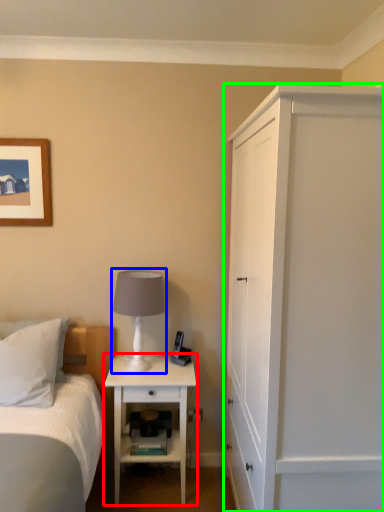
Question: Which object is positioned farthest from nightstand (highlighted by a red box)? Select from table lamp (highlighted by a blue box) and cabinetry (highlighted by a green box).

Choices:
 (A) table lamp
 (B) cabinetry

Answer: (B)